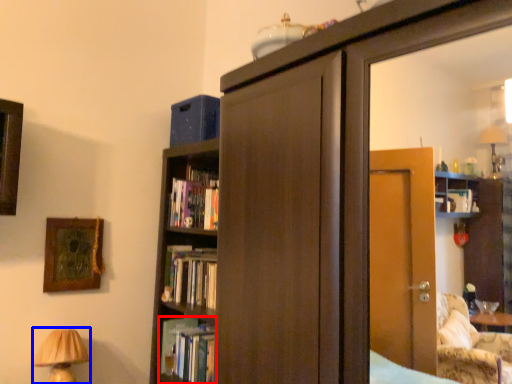
Question: Which point is closer to the camera, book (highlighted by a red box) or table lamp (highlighted by a blue box)?

Choices:
 (A) book
 (B) table lamp

Answer: (B)